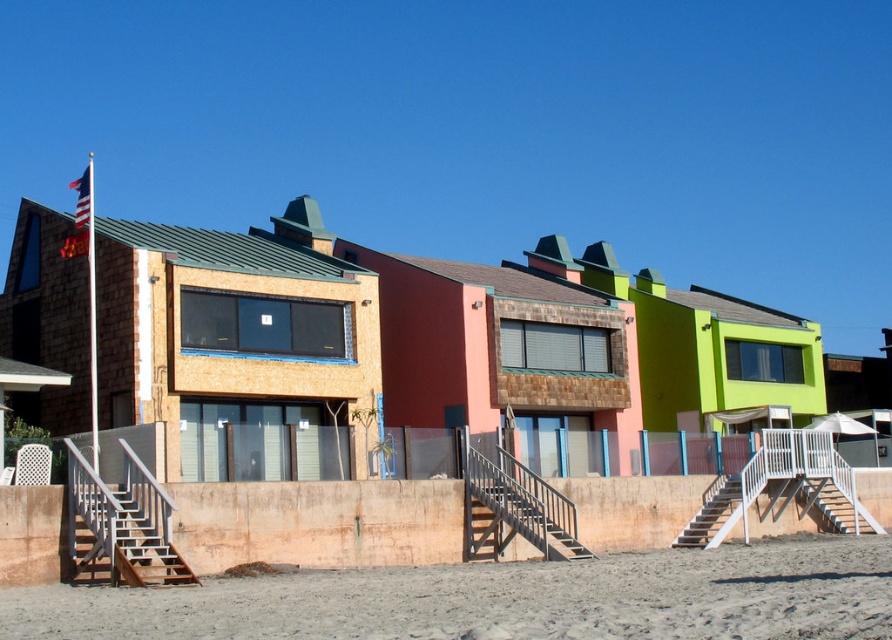
Which is behind, point (120, 522) or point (866, 515)?

The point (866, 515) is more distant.

Between brown wooden stairs at lower left and white metal stairs at lower right, which one is positioned higher?

Positioned higher is brown wooden stairs at lower left.

Is point (112, 509) closer to viewer compared to point (832, 509)?

Yes, point (112, 509) is closer to viewer.

Locate an element on the screen. The height and width of the screenshot is (640, 892). brown wooden stairs at lower left is located at coordinates (120, 540).

Which is behind, point (709, 513) or point (79, 196)?

The point (79, 196) is behind.

Who is taller, white wooden stairs at lower right or american flag at upper left?

american flag at upper left is taller.

The image size is (892, 640). I want to click on white wooden stairs at lower right, so click(x=713, y=516).

Who is positioned more to the right, brown sandy beach at lower center or wooden stairs at center?

Positioned to the right is brown sandy beach at lower center.

Between point (603, 621) and point (491, 524), which one is positioned behind?

Point (491, 524)

What do you see at coordinates (504, 598) in the screenshot? The width and height of the screenshot is (892, 640). I see `brown sandy beach at lower center` at bounding box center [504, 598].

Locate an element on the screen. The image size is (892, 640). brown sandy beach at lower center is located at coordinates (504, 598).